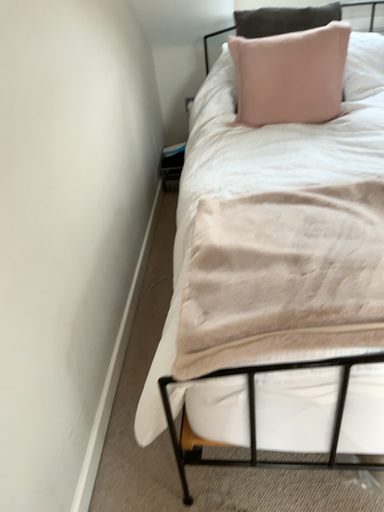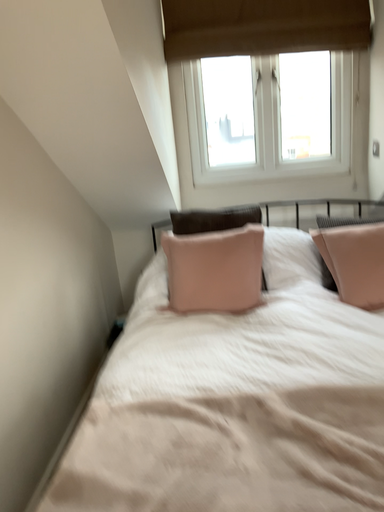
Question: How did the camera likely rotate when shooting the video?

Choices:
 (A) rotated downward
 (B) rotated upward

Answer: (B)